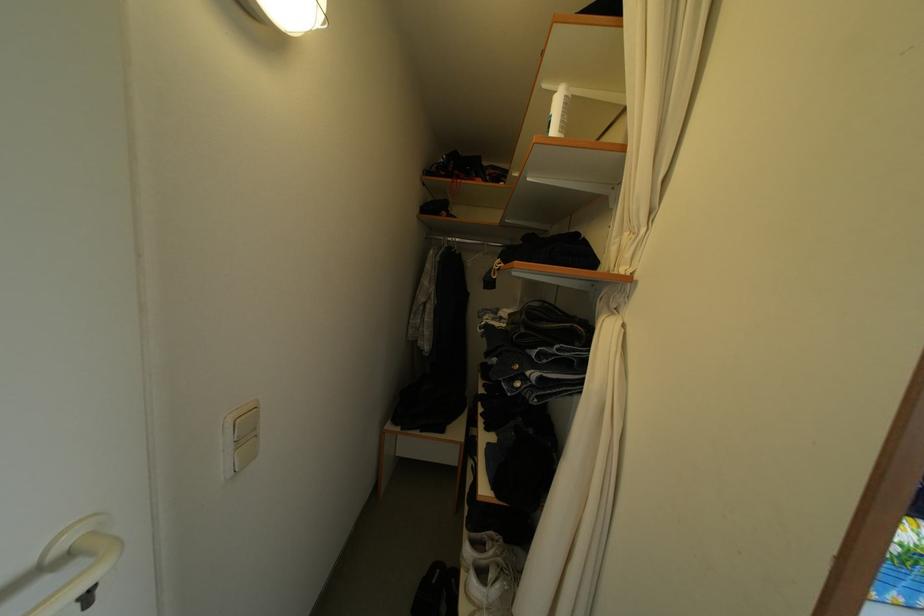
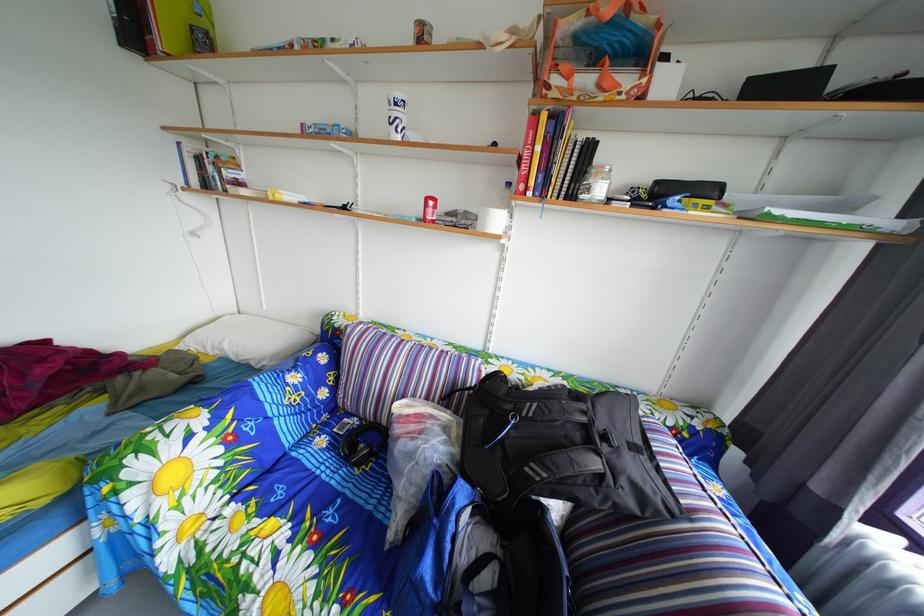
Question: In a continuous first-person perspective shot, in which direction is the camera moving?

Choices:
 (A) Left
 (B) Right
 (C) Forward
 (D) Backward

Answer: (B)